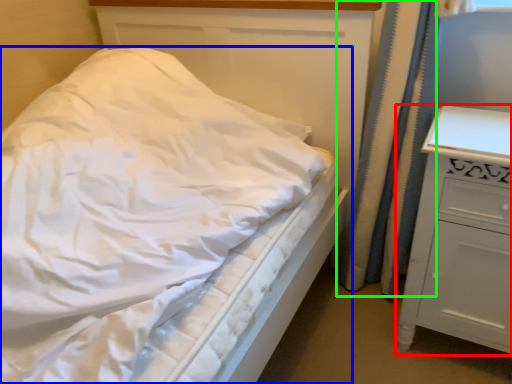
Question: Which is farther away from chest of drawers (highlighted by a red box)? bed (highlighted by a blue box) or curtain (highlighted by a green box)?

Choices:
 (A) bed
 (B) curtain

Answer: (A)